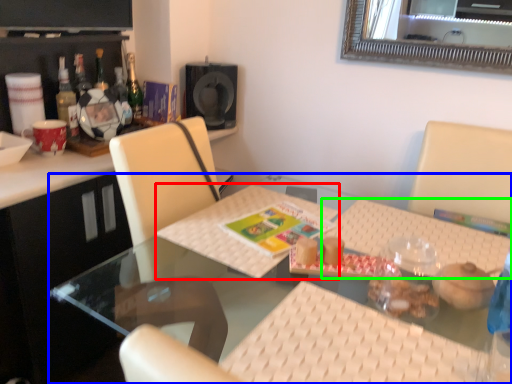
Question: Estimate the real-world distances between objects in this image. Which object is farther from place mat (highlighted by a red box), table (highlighted by a blue box) or place mat (highlighted by a green box)?

Choices:
 (A) table
 (B) place mat

Answer: (B)